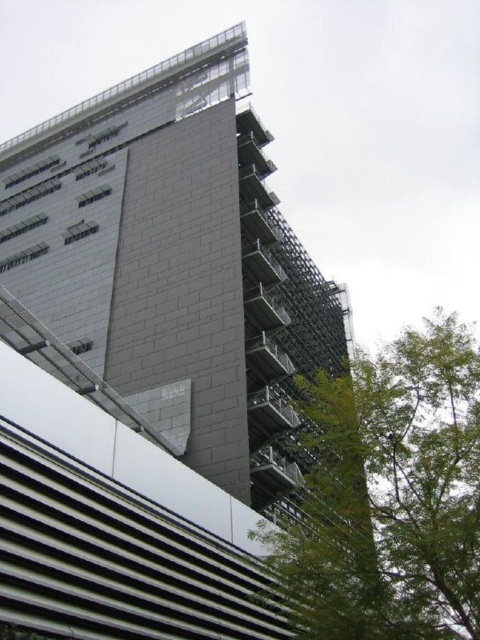
Question: Can you confirm if gray concrete building at upper center is bigger than green leafy tree at lower right?

Choices:
 (A) no
 (B) yes

Answer: (B)

Question: Does gray concrete building at upper center have a smaller size compared to green leafy tree at lower right?

Choices:
 (A) no
 (B) yes

Answer: (A)

Question: Among these objects, which one is farthest from the camera?

Choices:
 (A) green leafy tree at lower right
 (B) gray concrete building at upper center

Answer: (B)

Question: Among these points, which one is farthest from the camera?

Choices:
 (A) (223, 237)
 (B) (345, 417)

Answer: (A)

Question: Which object is farther from the camera taking this photo?

Choices:
 (A) green leafy tree at lower right
 (B) gray concrete building at upper center

Answer: (B)

Question: Is gray concrete building at upper center smaller than green leafy tree at lower right?

Choices:
 (A) yes
 (B) no

Answer: (B)